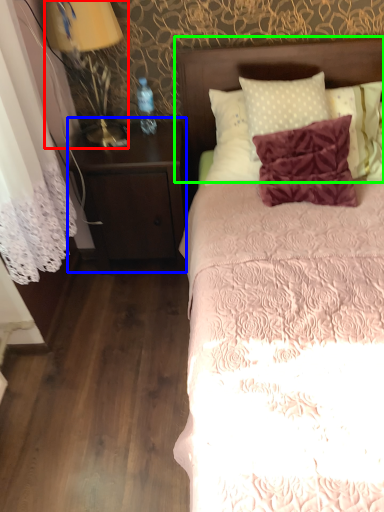
Question: Which object is positioned closest to bedside lamp (highlighted by a red box)? Select from nightstand (highlighted by a blue box) and headboard (highlighted by a green box).

Choices:
 (A) nightstand
 (B) headboard

Answer: (A)